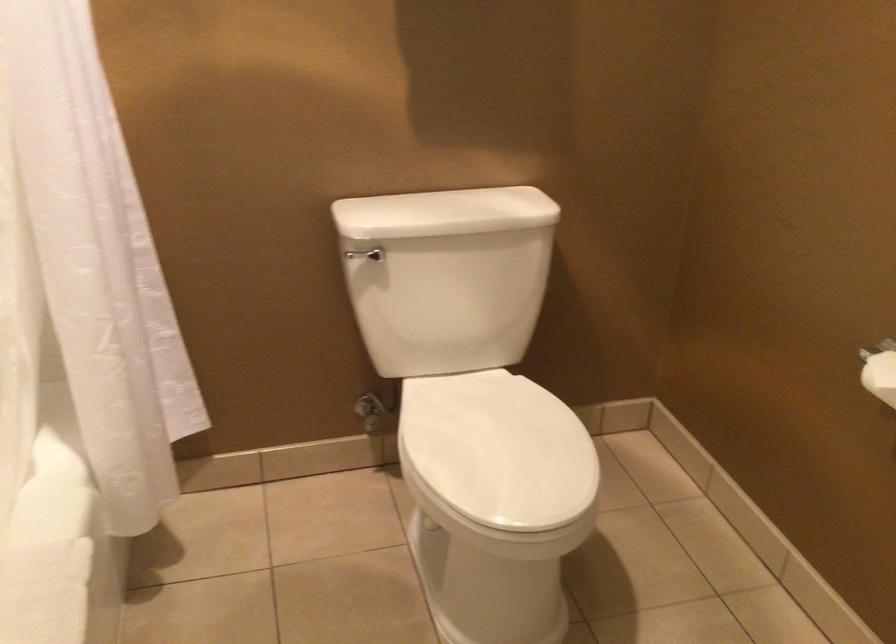
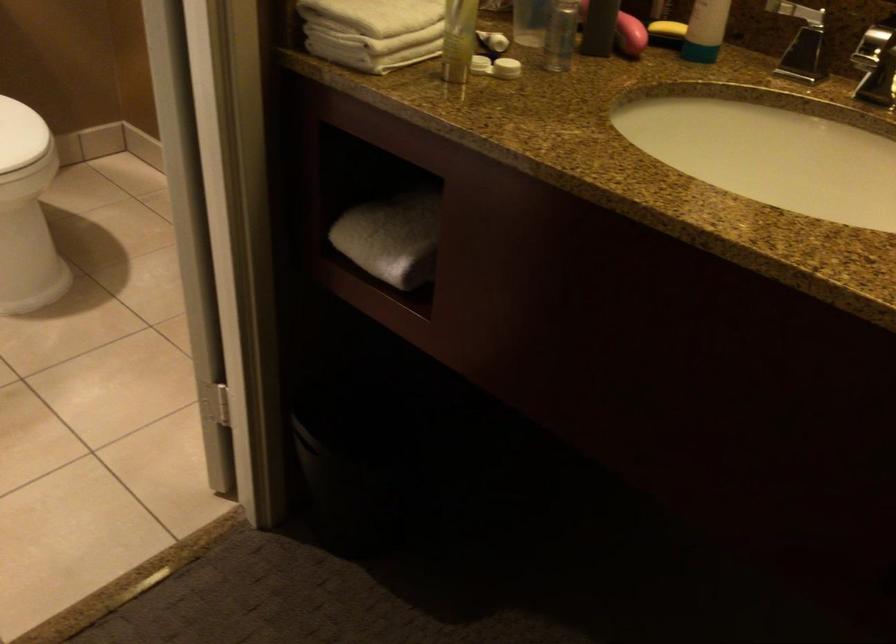
Find the pixel in the second image that matches point (565, 471) in the first image.

(20, 135)